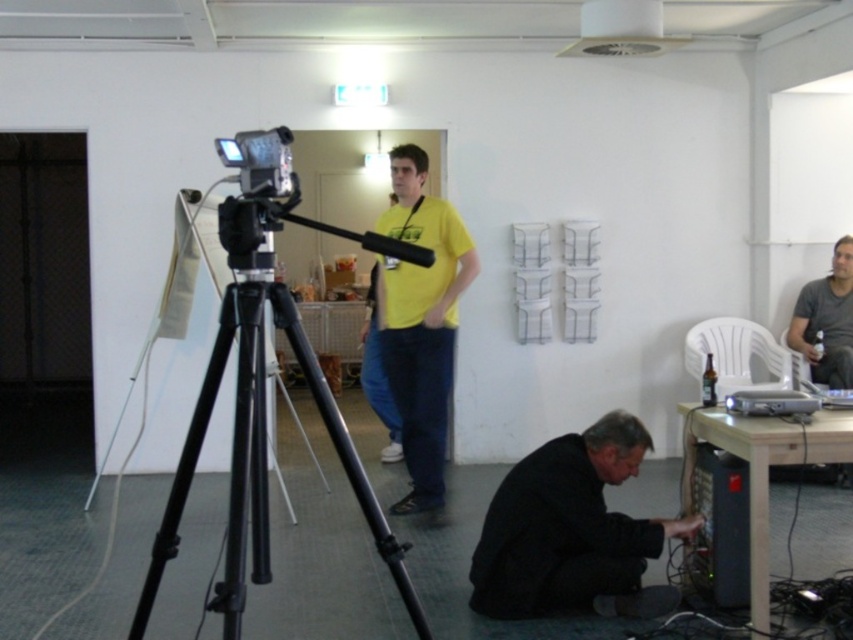
Question: Is the position of black metal tripod at center less distant than that of black matte jacket at lower center?

Choices:
 (A) yes
 (B) no

Answer: (A)

Question: Does yellow matte/yellow t-shirt at center appear on the right side of black plastic computer at lower right?

Choices:
 (A) yes
 (B) no

Answer: (B)

Question: Which of the following is the farthest from the observer?

Choices:
 (A) yellow matte/yellow t-shirt at center
 (B) black metal tripod at center
 (C) black plastic computer at lower right
 (D) black matte jacket at lower center

Answer: (A)

Question: Is yellow matte/yellow t-shirt at center positioned before black plastic computer at lower right?

Choices:
 (A) no
 (B) yes

Answer: (A)

Question: Which point is closer to the camera?

Choices:
 (A) black matte jacket at lower center
 (B) black metal tripod at center
 (C) yellow matte/yellow t-shirt at center
 (D) black plastic computer at lower right

Answer: (B)

Question: Which object appears closest to the camera in this image?

Choices:
 (A) yellow matte/yellow t-shirt at center
 (B) black matte jacket at lower center
 (C) black plastic computer at lower right

Answer: (B)